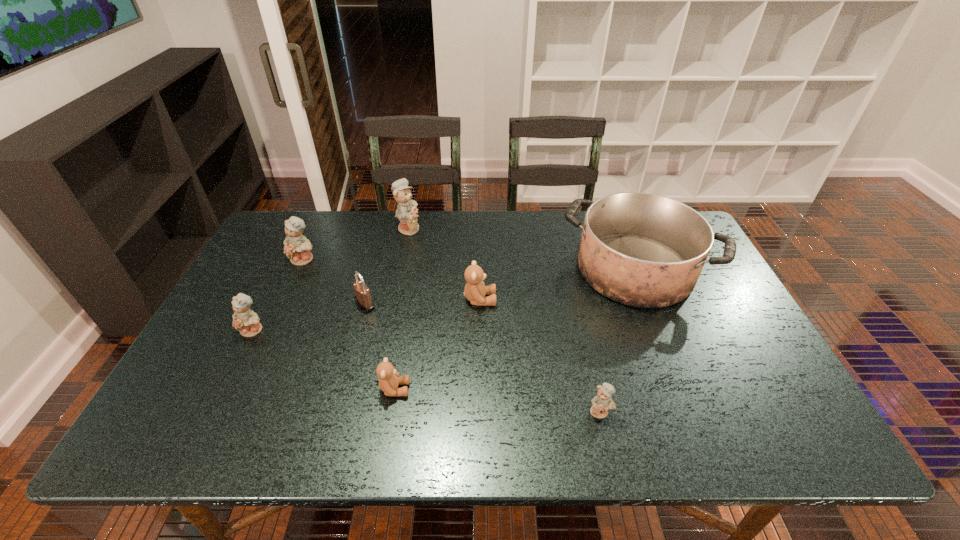
Image resolution: width=960 pixels, height=540 pixels. Identify the location of vacant space at the far left corner of the desktop. (300, 217).

This screenshot has height=540, width=960. Identify the location of free space at the near left corner of the desktop. (148, 436).

This screenshot has width=960, height=540. I want to click on free space between the second smallest blue teddy bear and the third object from left to right, so click(x=309, y=317).

At what (x,y) coordinates should I click in order to perform the action: click on vacant space that is in between the farthest teddy bear and the nearest blue teddy bear. Please return your answer as a coordinate pair (x, y). Looking at the image, I should click on (505, 320).

Where is `vacant area that lies between the second nearest object and the rightmost blue teddy bear`? vacant area that lies between the second nearest object and the rightmost blue teddy bear is located at coordinates click(x=497, y=400).

At what (x,y) coordinates should I click in order to perform the action: click on vacant space in between the sixth object from right to left and the left brown teddy bear. Please return your answer as a coordinate pair (x, y). Looking at the image, I should click on (380, 347).

Identify the location of free space between the saucepan and the third farthest teddy bear. (558, 285).

Where is `free area in between the rightmost blue teddy bear and the fifth shortest teddy bear`? The width and height of the screenshot is (960, 540). free area in between the rightmost blue teddy bear and the fifth shortest teddy bear is located at coordinates (452, 336).

In order to click on free spot between the nearer brown teddy bear and the saucepan in this screenshot , I will do `click(515, 329)`.

This screenshot has width=960, height=540. I want to click on free spot between the farthest blue teddy bear and the sixth farthest object, so click(x=331, y=279).